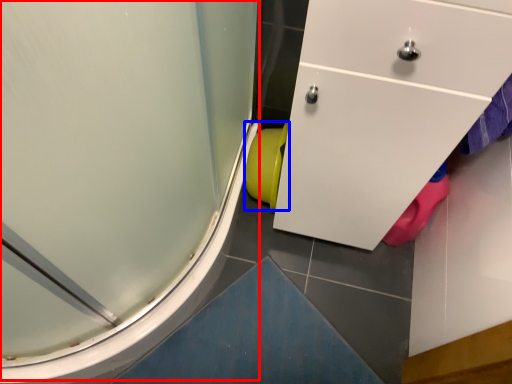
Question: Which object is further to the camera taking this photo, shower door (highlighted by a red box) or toilet bowl (highlighted by a blue box)?

Choices:
 (A) shower door
 (B) toilet bowl

Answer: (B)